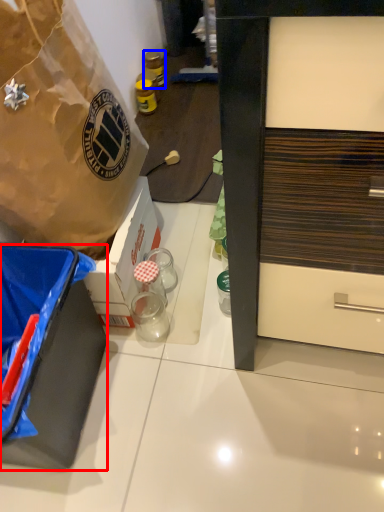
Question: Which point is further to the camera, box (highlighted by a red box) or bottle (highlighted by a blue box)?

Choices:
 (A) box
 (B) bottle

Answer: (B)